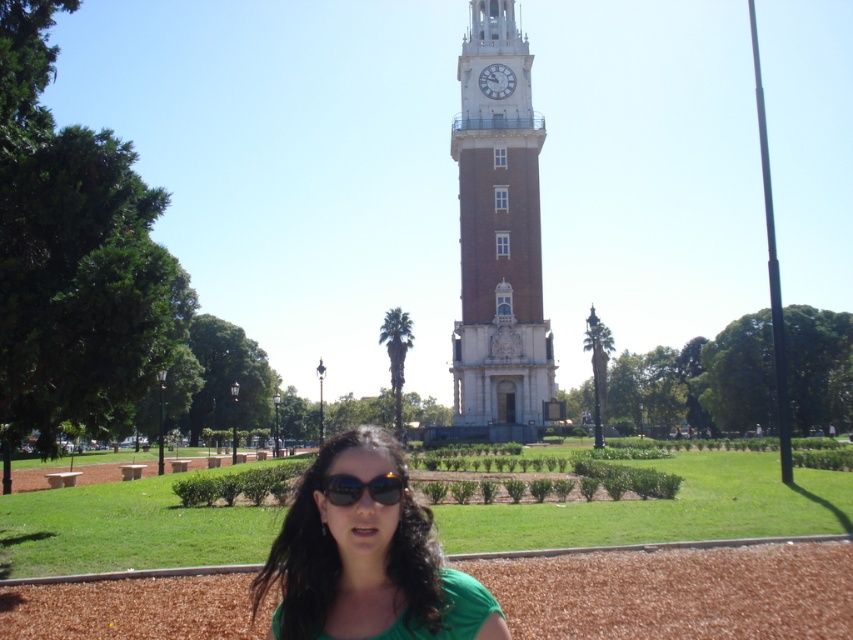
You are standing in the park and see the brown brick clock tower at center and the green matte shirt at center. Which object is closer to you?

The brown brick clock tower at center is closer to you because the green matte shirt at center is behind it.